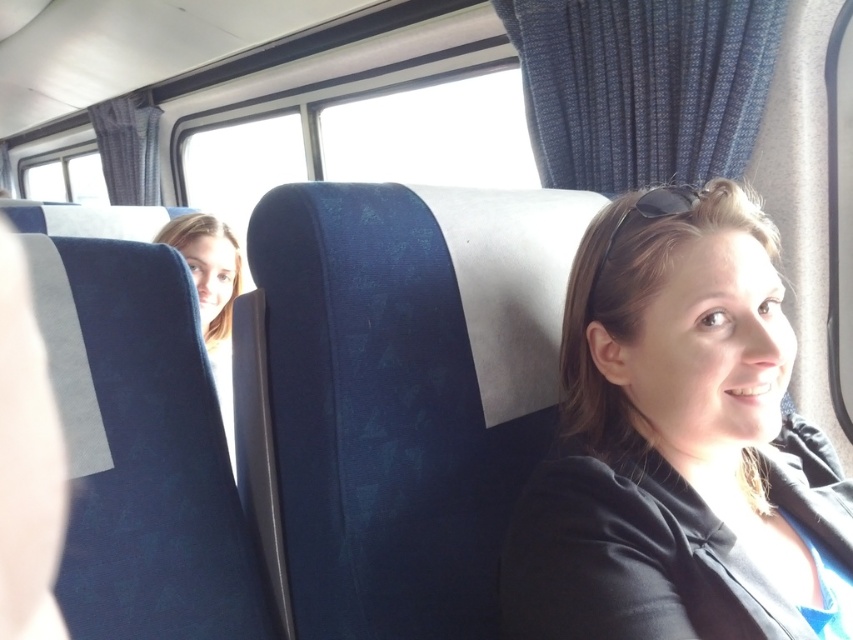
Is the position of matte black jacket at center less distant than that of sunglasses at center?

Yes, matte black jacket at center is in front of sunglasses at center.

Does matte black jacket at center appear on the right side of sunglasses at center?

Yes, matte black jacket at center is to the right of sunglasses at center.

Which is behind, point (780, 420) or point (605, 248)?

The point (605, 248) is behind.

Locate an element on the screen. matte black jacket at center is located at coordinates (672, 440).

Does matte black jacket at center have a larger size compared to blonde hair at upper left?

No.

Is matte black jacket at center closer to the viewer compared to blonde hair at upper left?

Yes, it is.

The width and height of the screenshot is (853, 640). In order to click on matte black jacket at center in this screenshot , I will do `click(672, 440)`.

Does blonde hair at upper left lie in front of sunglasses at center?

No, blonde hair at upper left is further to the viewer.

Does point (231, 292) lie behind point (660, 202)?

Yes, point (231, 292) is farther from viewer.

This screenshot has height=640, width=853. What are the coordinates of `blonde hair at upper left` in the screenshot? It's located at (212, 296).